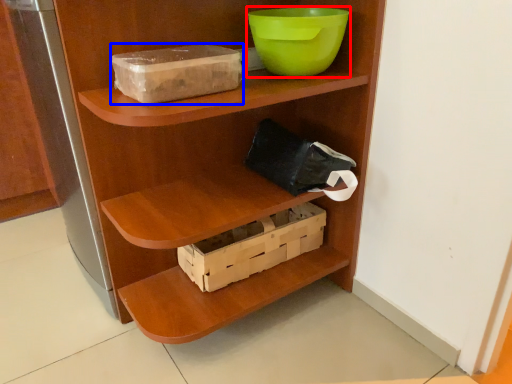
Question: Which of the following is the farthest to the observer, bowl (highlighted by a red box) or storage box (highlighted by a blue box)?

Choices:
 (A) bowl
 (B) storage box

Answer: (A)